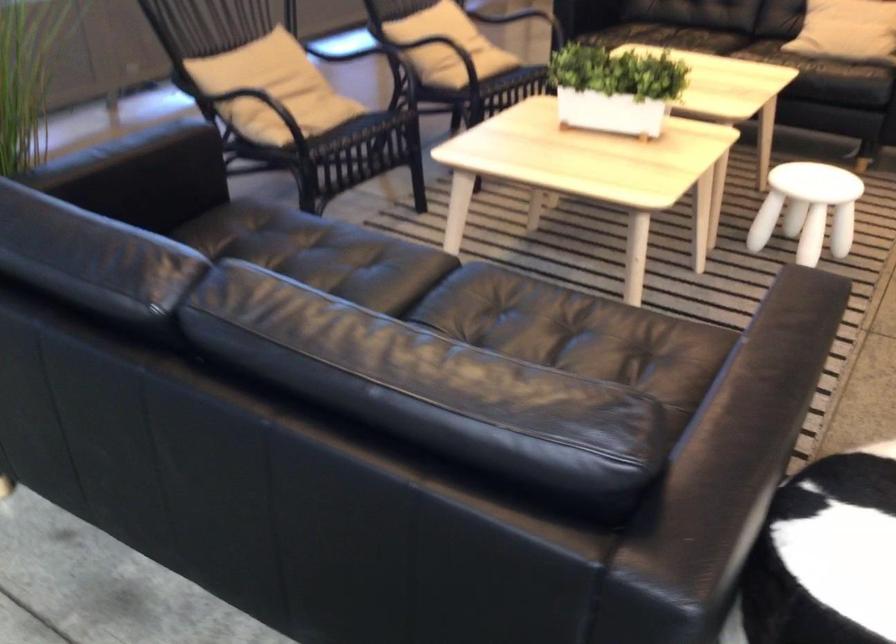
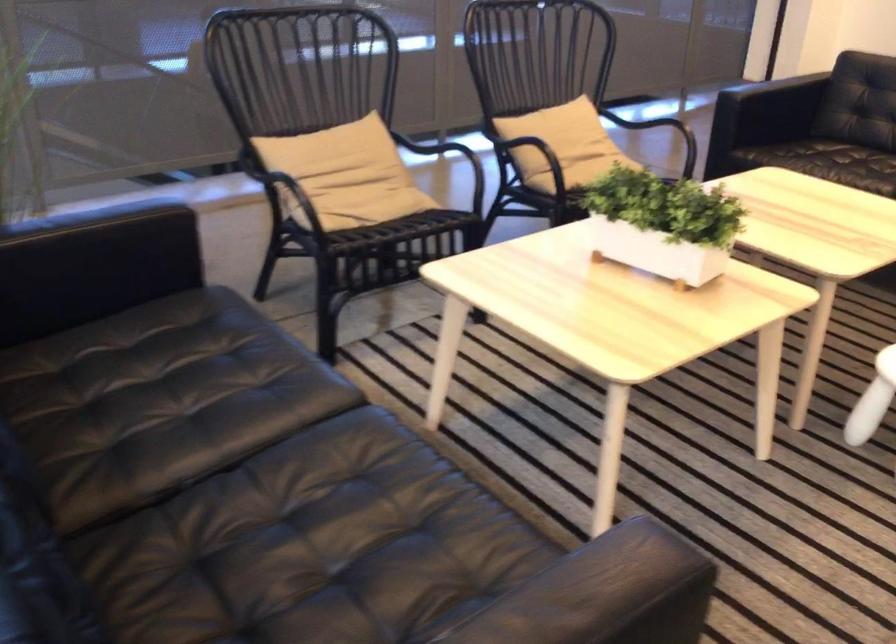
What movement of the cameraman would produce the second image?

The cameraman walked toward right, forward.